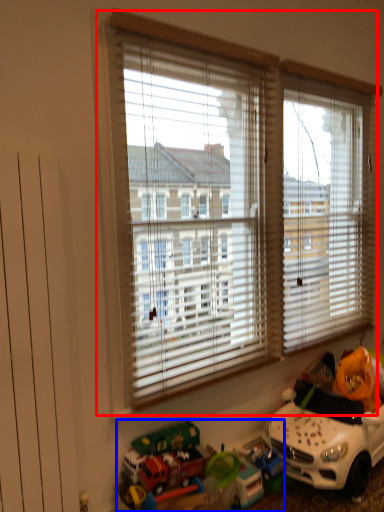
Question: Among these objects, which one is farthest to the camera, window (highlighted by a red box) or toy (highlighted by a blue box)?

Choices:
 (A) window
 (B) toy

Answer: (A)